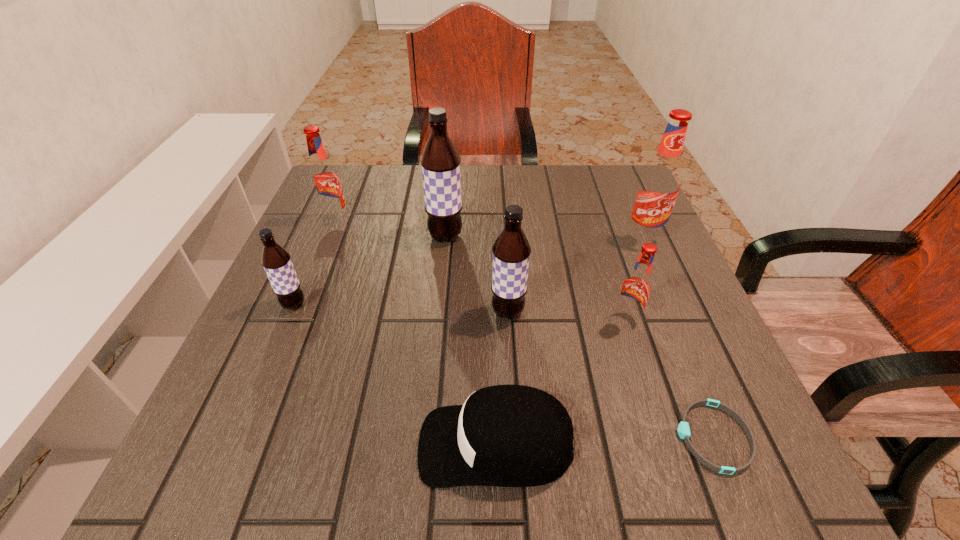
Identify which root beer is located as the fourth nearest to the fourth root beer from left to right. Please provide its 2D coordinates. Your answer should be formatted as a tuple, i.e. [(x, y)], where the tuple contains the x and y coordinates of a point satisfying the conditions above.

[(276, 261)]

Identify which red root beer is located as the nearest to the leftmost red root beer. Please provide its 2D coordinates. Your answer should be formatted as a tuple, i.e. [(x, y)], where the tuple contains the x and y coordinates of a point satisfying the conditions above.

[(636, 288)]

In order to click on red root beer that is the second closest to the leftmost red root beer in this screenshot , I will do `click(660, 182)`.

You are a GUI agent. You are given a task and a screenshot of the screen. Output one action in this format:
    pyautogui.click(x=<x>, y=<y>)
    Task: Click on the closest brown root beer relative to the biggest brown root beer
    
    Given the screenshot: What is the action you would take?
    pyautogui.click(x=511, y=251)

Locate which brown root beer ranks second in proximity to the leftmost brown root beer. Please provide its 2D coordinates. Your answer should be formatted as a tuple, i.e. [(x, y)], where the tuple contains the x and y coordinates of a point satisfying the conditions above.

[(511, 251)]